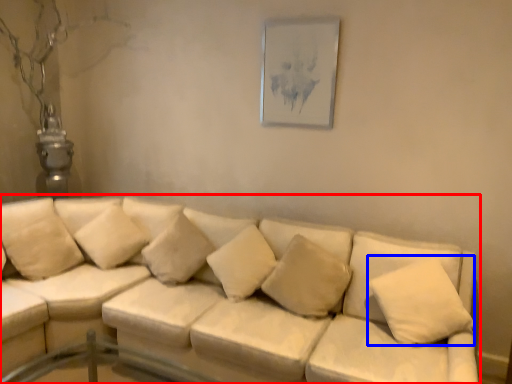
Question: Among these objects, which one is nearest to the camera, studio couch (highlighted by a red box) or pillow (highlighted by a blue box)?

Choices:
 (A) studio couch
 (B) pillow

Answer: (A)